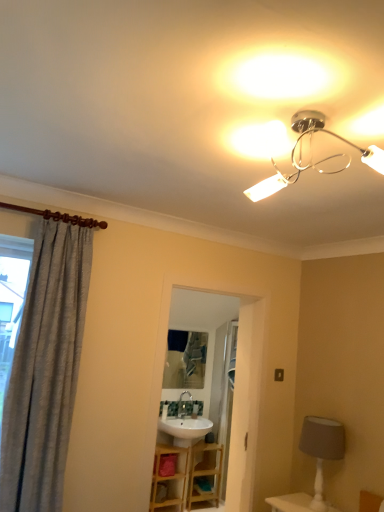
Question: Is gray textured curtain at left surrounded by white textured table lamp at lower right?

Choices:
 (A) yes
 (B) no

Answer: (B)

Question: Considering the relative sizes of white textured table lamp at lower right and gray textured curtain at left in the image provided, is white textured table lamp at lower right smaller than gray textured curtain at left?

Choices:
 (A) yes
 (B) no

Answer: (A)

Question: From a real-world perspective, is white textured table lamp at lower right located beneath gray textured curtain at left?

Choices:
 (A) yes
 (B) no

Answer: (A)

Question: Can you confirm if white textured table lamp at lower right is bigger than gray textured curtain at left?

Choices:
 (A) no
 (B) yes

Answer: (A)

Question: Is white textured table lamp at lower right directly adjacent to gray textured curtain at left?

Choices:
 (A) yes
 (B) no

Answer: (B)

Question: Considering the relative sizes of white textured table lamp at lower right and gray textured curtain at left in the image provided, is white textured table lamp at lower right wider than gray textured curtain at left?

Choices:
 (A) no
 (B) yes

Answer: (B)

Question: Considering the relative sizes of metallic reflective mirror at center and gray textured curtain at left in the image provided, is metallic reflective mirror at center shorter than gray textured curtain at left?

Choices:
 (A) yes
 (B) no

Answer: (A)

Question: Is metallic reflective mirror at center far from gray textured curtain at left?

Choices:
 (A) no
 (B) yes

Answer: (B)

Question: Is metallic reflective mirror at center smaller than gray textured curtain at left?

Choices:
 (A) no
 (B) yes

Answer: (B)

Question: Does metallic reflective mirror at center have a greater height compared to gray textured curtain at left?

Choices:
 (A) no
 (B) yes

Answer: (A)

Question: From the image's perspective, is metallic reflective mirror at center below gray textured curtain at left?

Choices:
 (A) yes
 (B) no

Answer: (A)

Question: Is metallic reflective mirror at center wider than gray textured curtain at left?

Choices:
 (A) no
 (B) yes

Answer: (A)

Question: Is gray textured curtain at left at the right side of wooden vanity at center?

Choices:
 (A) no
 (B) yes

Answer: (A)